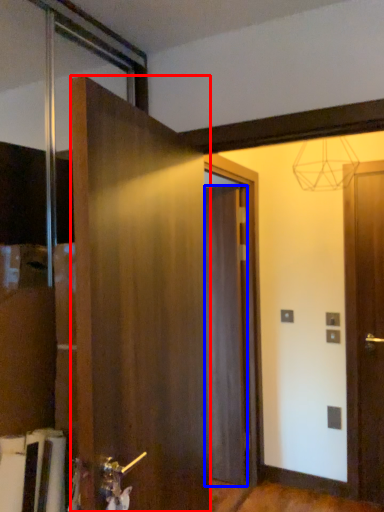
Question: Among these objects, which one is nearest to the camera, door (highlighted by a red box) or door (highlighted by a blue box)?

Choices:
 (A) door
 (B) door

Answer: (A)